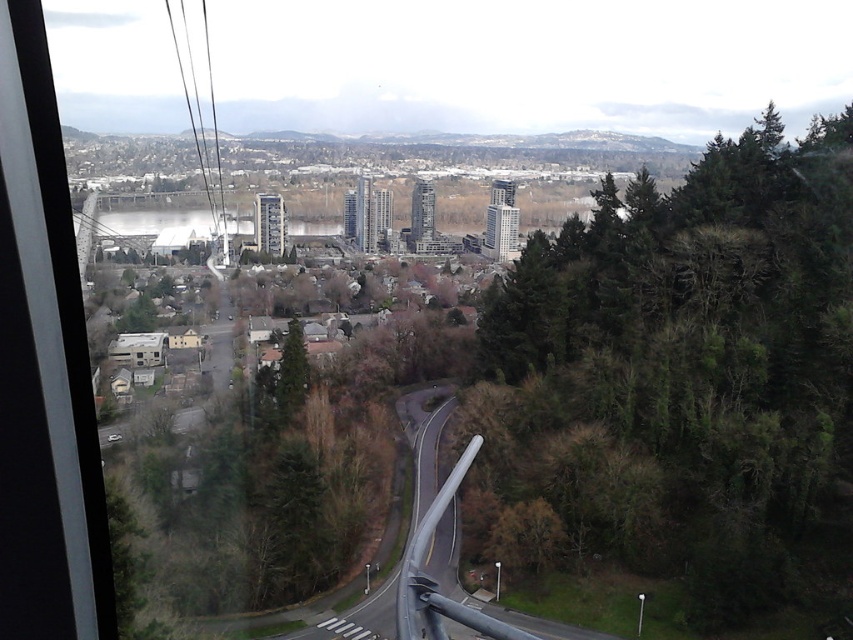
Can you confirm if green leafy trees at right is positioned below green matte tree at center?

No, green leafy trees at right is not below green matte tree at center.

Is point (712, 221) positioned in front of point (286, 365)?

Yes, point (712, 221) is closer to viewer.

Is point (624, 353) more distant than point (285, 365)?

No, it is in front of (285, 365).

This screenshot has height=640, width=853. I want to click on green leafy trees at right, so click(x=683, y=372).